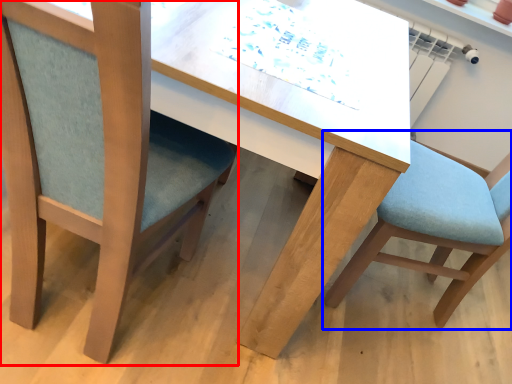
Question: Which object is further to the camera taking this photo, chair (highlighted by a red box) or chair (highlighted by a blue box)?

Choices:
 (A) chair
 (B) chair

Answer: (B)